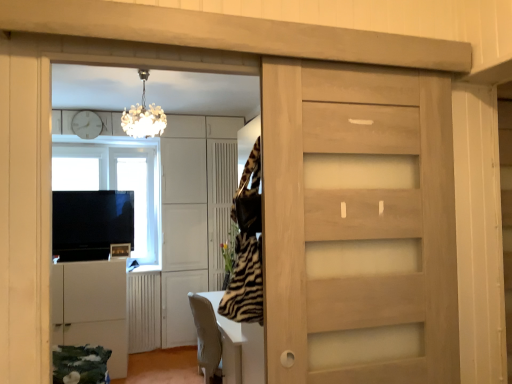
This screenshot has width=512, height=384. What are the coordinates of `vacant space situated above matte white cabinet at left (from a real-world perspective)` in the screenshot? It's located at (166, 44).